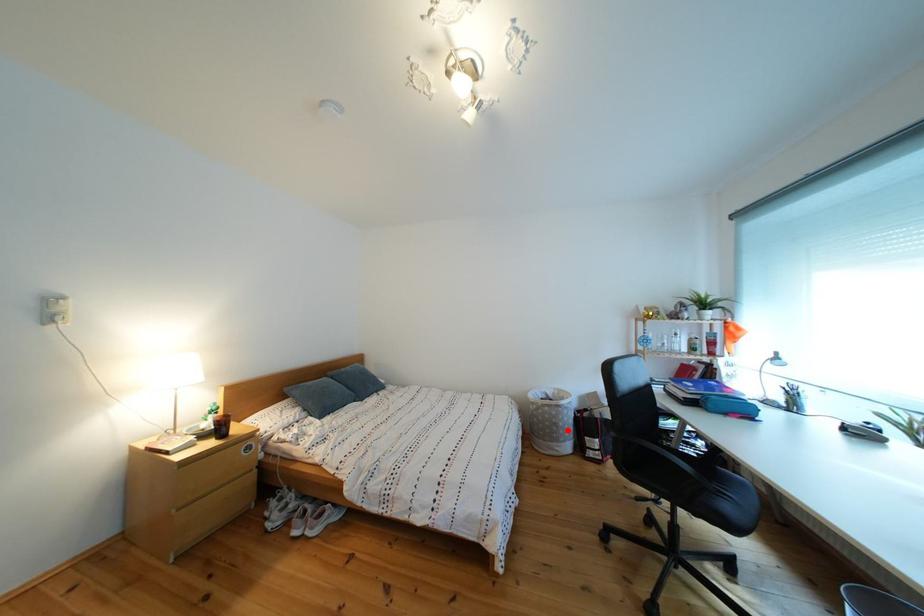
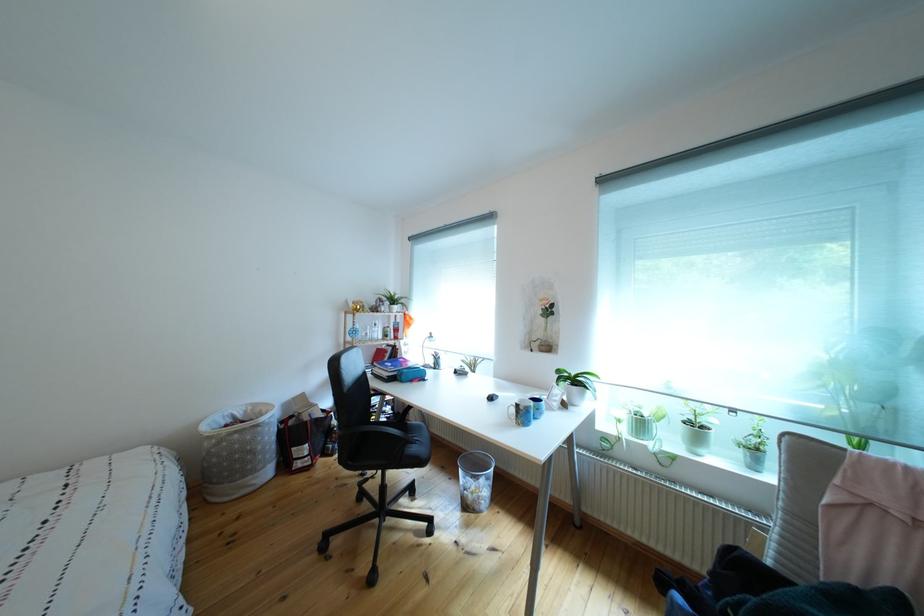
Find the pixel in the second image that matches the highlighted location in the first image.

(263, 456)